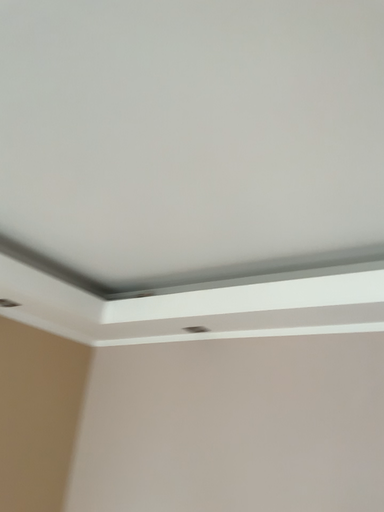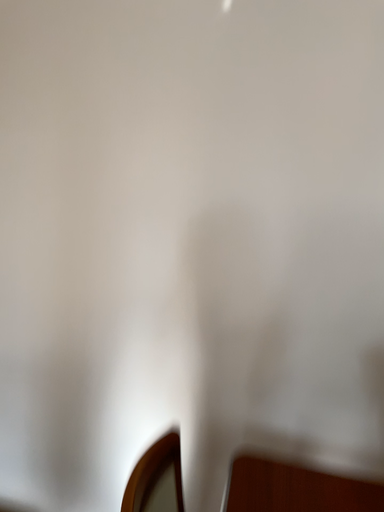
Question: How did the camera likely rotate when shooting the video?

Choices:
 (A) rotated downward
 (B) rotated upward

Answer: (A)